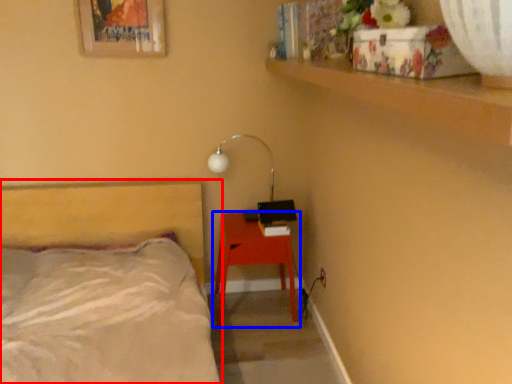
Question: Which point is closer to the camera, bed (highlighted by a red box) or nightstand (highlighted by a blue box)?

Choices:
 (A) bed
 (B) nightstand

Answer: (A)